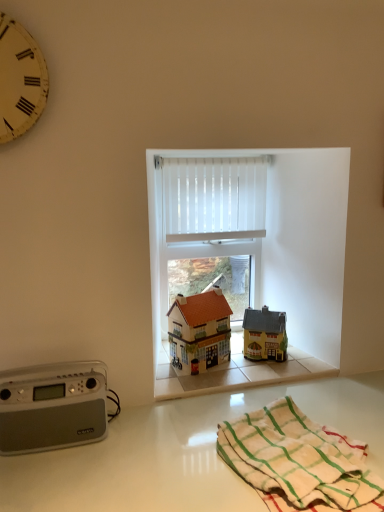
Question: In terms of width, does white vertical blinds at center look wider or thinner when compared to white cotton towel at lower right?

Choices:
 (A) wide
 (B) thin

Answer: (B)

Question: Would you say white vertical blinds at center is to the left or to the right of white cotton towel at lower right in the picture?

Choices:
 (A) right
 (B) left

Answer: (B)

Question: Estimate the real-world distances between objects in this image. Which object is closer to the white cotton towel at lower right?

Choices:
 (A) yellow matte house at center, the second toy in the left-to-right sequence
 (B) yellow painted wood clock at upper left
 (C) gray plastic stereo at lower left
 (D) matte orange roofed house at center, the first toy in the left-to-right sequence
 (E) white glossy countertop at lower center

Answer: (E)

Question: Which is nearer to the yellow painted wood clock at upper left?

Choices:
 (A) white vertical blinds at center
 (B) gray plastic stereo at lower left
 (C) white cotton towel at lower right
 (D) white glossy countertop at lower center
 (E) yellow matte house at center, the second toy in the left-to-right sequence

Answer: (B)